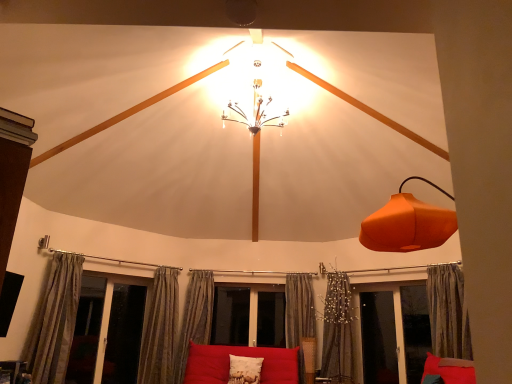
Question: From the image's perspective, is transparent glass screen door at lower left, the 3th screen door positioned from the right, over silky gray curtain at lower center, positioned as the 2th curtain in right-to-left order?

Choices:
 (A) yes
 (B) no

Answer: (B)

Question: Considering the relative sizes of transparent glass screen door at lower left, arranged as the 1th screen door when viewed from the left, and silky gray curtain at lower center, positioned as the 2th curtain in right-to-left order, in the image provided, is transparent glass screen door at lower left, arranged as the 1th screen door when viewed from the left, shorter than silky gray curtain at lower center, positioned as the 2th curtain in right-to-left order,?

Choices:
 (A) no
 (B) yes

Answer: (B)

Question: Is transparent glass screen door at lower left, arranged as the 1th screen door when viewed from the left, surrounding silky gray curtain at lower center, the fifth curtain when ordered from left to right?

Choices:
 (A) no
 (B) yes

Answer: (A)

Question: From the image's perspective, is transparent glass screen door at lower left, the 3th screen door positioned from the right, located beneath silky gray curtain at lower center, the fifth curtain when ordered from left to right?

Choices:
 (A) yes
 (B) no

Answer: (A)

Question: Is transparent glass screen door at lower left, arranged as the 1th screen door when viewed from the left, thinner than silky gray curtain at lower center, the fifth curtain when ordered from left to right?

Choices:
 (A) no
 (B) yes

Answer: (B)

Question: From a real-world perspective, does transparent glass screen door at lower left, the 3th screen door positioned from the right, stand above silky gray curtain at lower center, positioned as the 2th curtain in right-to-left order?

Choices:
 (A) no
 (B) yes

Answer: (A)

Question: Considering the relative sizes of transparent glass screen door at lower right, arranged as the second screen door when viewed from the left, and silky beige curtain at lower left, the second curtain from the left, in the image provided, is transparent glass screen door at lower right, arranged as the second screen door when viewed from the left, bigger than silky beige curtain at lower left, the second curtain from the left,?

Choices:
 (A) no
 (B) yes

Answer: (A)

Question: Is transparent glass screen door at lower right, which appears as the 2th screen door when viewed from the right, facing towards silky beige curtain at lower left, the second curtain from the left?

Choices:
 (A) no
 (B) yes

Answer: (A)

Question: Does transparent glass screen door at lower right, arranged as the second screen door when viewed from the left, have a smaller size compared to silky beige curtain at lower left, positioned as the fifth curtain in right-to-left order?

Choices:
 (A) no
 (B) yes

Answer: (B)

Question: From the image's perspective, does transparent glass screen door at lower right, which appears as the 2th screen door when viewed from the right, appear higher than silky beige curtain at lower left, the second curtain from the left?

Choices:
 (A) yes
 (B) no

Answer: (B)

Question: Would you say transparent glass screen door at lower right, which appears as the 2th screen door when viewed from the right, contains silky beige curtain at lower left, the second curtain from the left?

Choices:
 (A) yes
 (B) no

Answer: (B)

Question: Is transparent glass screen door at lower right, which appears as the 2th screen door when viewed from the right, to the right of silky beige curtain at lower left, positioned as the fifth curtain in right-to-left order, from the viewer's perspective?

Choices:
 (A) no
 (B) yes

Answer: (B)

Question: Considering the relative sizes of matte red couch at center and orange matte lampshade at right in the image provided, is matte red couch at center bigger than orange matte lampshade at right?

Choices:
 (A) no
 (B) yes

Answer: (A)